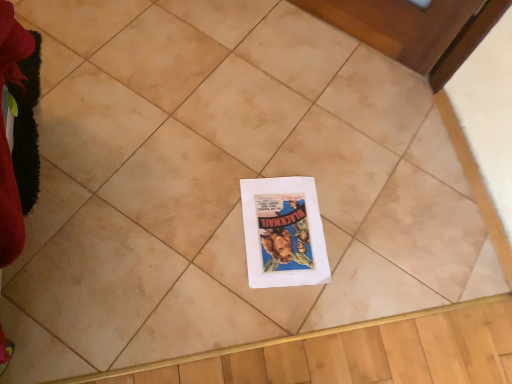
You are a GUI agent. You are given a task and a screenshot of the screen. Output one action in this format:
    pyautogui.click(x=<x>, y=<y>)
    Task: Click on the unoccupied space behind white paper flyer at center
    The width and height of the screenshot is (512, 384).
    Given the screenshot: What is the action you would take?
    pyautogui.click(x=305, y=156)